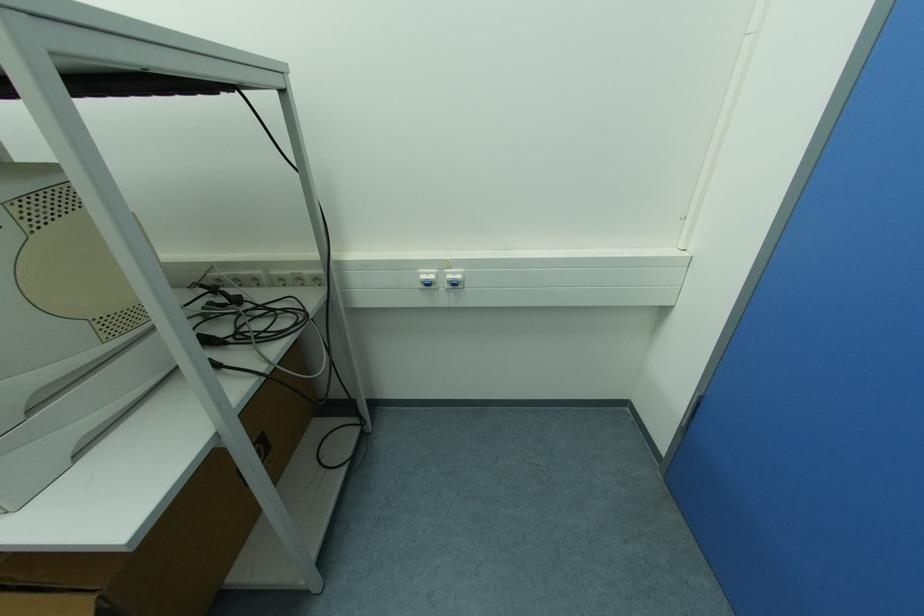
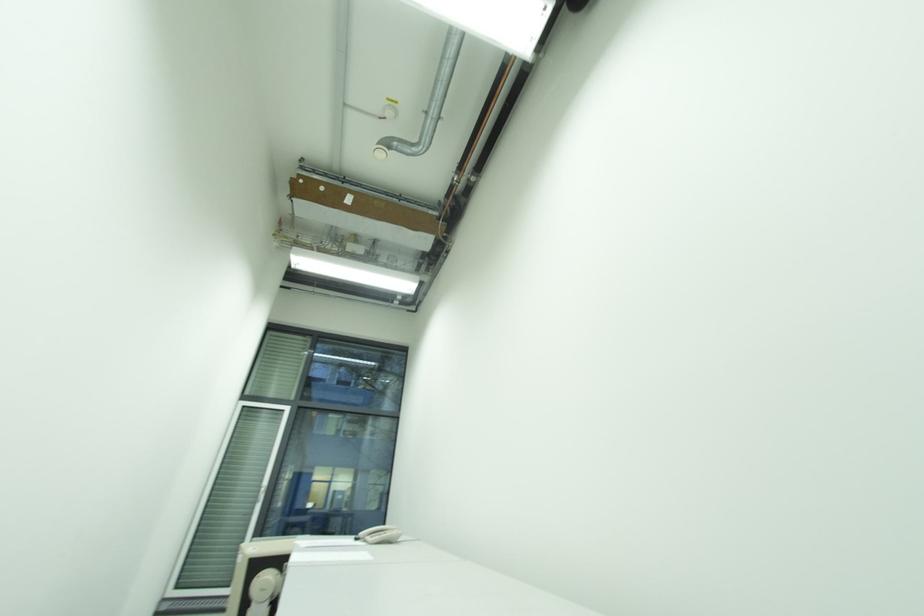
First-person continuous shooting, in which direction is the camera rotating?

The camera's rotation is toward left-up.